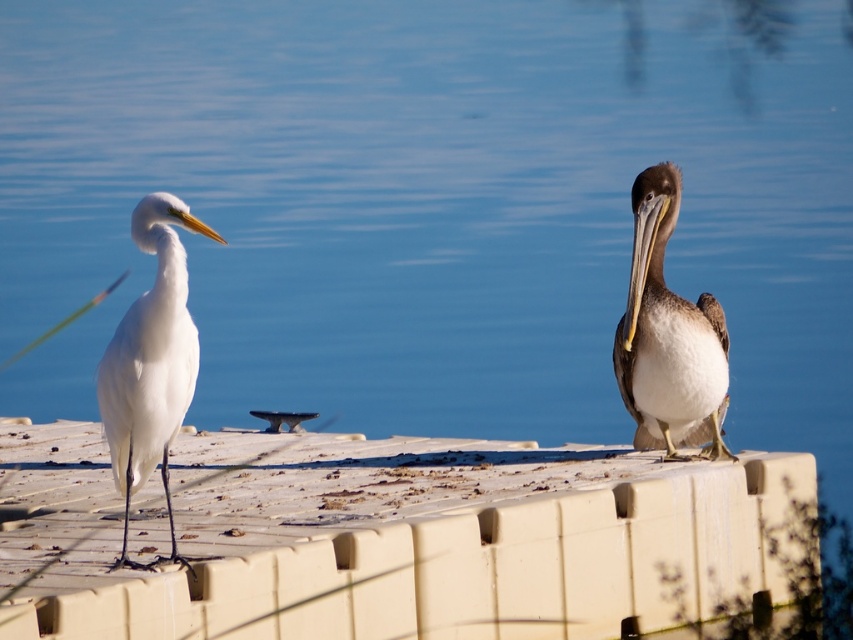
You are a photographer trying to capture both birds in a single shot. Given that the brown feathered pelican at right is smaller in size compared to the white matte bird at left, which bird should you focus on to ensure both fit in the frame without cropping?

Since the brown feathered pelican at right occupies less space than the white matte bird at left, you should focus on the white matte bird at left to ensure both birds fit in the frame without cropping.

In the scene shown: You are a small robot with a width of 2 feet. You are standing on the white plastic dock at center and want to move to the white matte bird at left. Can you navigate the space between them without any obstacles?

The distance between the white plastic dock at center and the white matte bird at left is 10.45 feet. Since the robot is only 2 feet wide, there is sufficient space for it to move between them without any issues.

You are a birdwatcher observing the two birds on the dock. Which bird is taller, the brown feathered pelican at right or the white matte bird at left?

The brown feathered pelican at right is taller than the white matte bird at left according to the description.